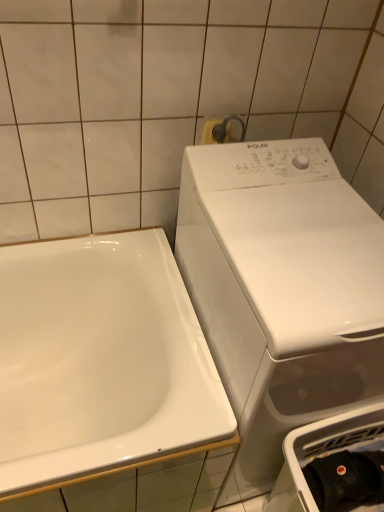
Question: Is white plastic dish washer at lower right at the right side of white glossy washing machine at right?

Choices:
 (A) yes
 (B) no

Answer: (A)

Question: Is white plastic dish washer at lower right not within white glossy washing machine at right?

Choices:
 (A) no
 (B) yes

Answer: (B)

Question: Considering the relative sizes of white plastic dish washer at lower right and white glossy washing machine at right in the image provided, is white plastic dish washer at lower right shorter than white glossy washing machine at right?

Choices:
 (A) no
 (B) yes

Answer: (B)

Question: Is white plastic dish washer at lower right aimed at white glossy washing machine at right?

Choices:
 (A) no
 (B) yes

Answer: (A)

Question: Considering the relative sizes of white plastic dish washer at lower right and white glossy washing machine at right in the image provided, is white plastic dish washer at lower right bigger than white glossy washing machine at right?

Choices:
 (A) yes
 (B) no

Answer: (B)

Question: Looking at their shapes, would you say white glossy sink at left is wider or thinner than white plastic dish washer at lower right?

Choices:
 (A) wide
 (B) thin

Answer: (A)

Question: In the image, is white glossy sink at left on the left side or the right side of white plastic dish washer at lower right?

Choices:
 (A) left
 (B) right

Answer: (A)

Question: Is white glossy sink at left in front of or behind white plastic dish washer at lower right in the image?

Choices:
 (A) behind
 (B) front

Answer: (B)

Question: Which is correct: white glossy sink at left is inside white plastic dish washer at lower right, or outside of it?

Choices:
 (A) outside
 (B) inside

Answer: (A)

Question: From a real-world perspective, is white glossy sink at left positioned above or below white glossy washing machine at right?

Choices:
 (A) above
 (B) below

Answer: (B)

Question: Is white glossy sink at left taller or shorter than white glossy washing machine at right?

Choices:
 (A) tall
 (B) short

Answer: (B)

Question: Is white glossy sink at left wider or thinner than white glossy washing machine at right?

Choices:
 (A) wide
 (B) thin

Answer: (A)

Question: From the image's perspective, is white glossy sink at left above or below white glossy washing machine at right?

Choices:
 (A) above
 (B) below

Answer: (B)

Question: Is white glossy washing machine at right wider or thinner than black cotton cap at lower right?

Choices:
 (A) thin
 (B) wide

Answer: (B)

Question: Based on their sizes in the image, would you say white glossy washing machine at right is bigger or smaller than black cotton cap at lower right?

Choices:
 (A) small
 (B) big

Answer: (B)